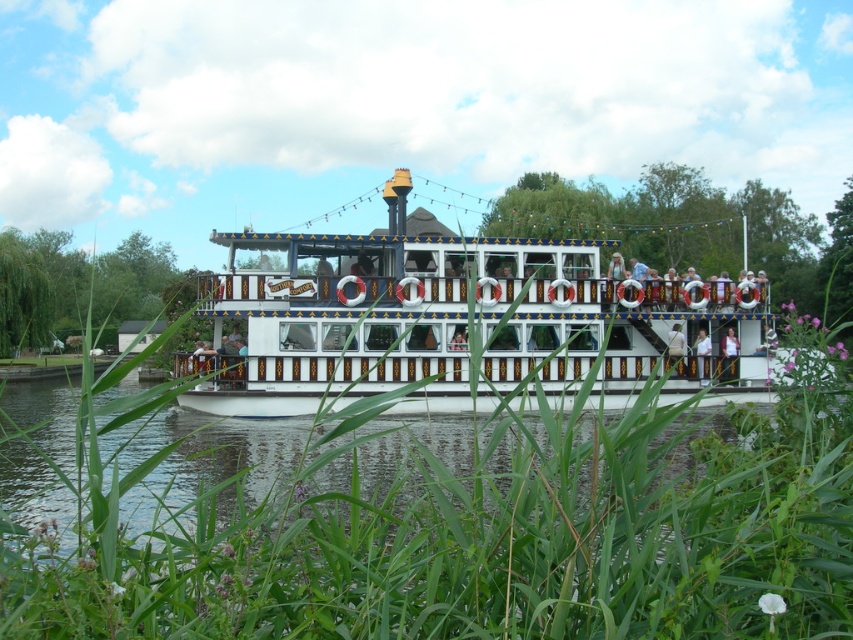
Describe the element at coordinates (451, 461) in the screenshot. I see `white painted wooden boat at center` at that location.

Is the position of white painted wooden boat at center less distant than that of white painted wood boat at center?

Yes.

Between point (570, 442) and point (637, 305), which one is positioned in front?

Point (570, 442) is in front.

The height and width of the screenshot is (640, 853). I want to click on white painted wooden boat at center, so click(451, 461).

Does white painted wooden boat at center appear on the left side of white smooth water at center?

No, white painted wooden boat at center is not to the left of white smooth water at center.

Between white painted wooden boat at center and white smooth water at center, which one appears on the left side from the viewer's perspective?

From the viewer's perspective, white smooth water at center appears more on the left side.

Which is in front, point (222, 572) or point (393, 417)?

Point (222, 572)

You are a GUI agent. You are given a task and a screenshot of the screen. Output one action in this format:
    pyautogui.click(x=<x>, y=<y>)
    Task: Click on the white painted wooden boat at center
    
    Given the screenshot: What is the action you would take?
    pyautogui.click(x=451, y=461)

Can you confirm if white painted wood boat at center is thinner than white smooth water at center?

Yes.

At what (x,y) coordinates should I click in order to perform the action: click on white painted wood boat at center. Please return your answer as a coordinate pair (x, y). Looking at the image, I should click on (463, 321).

This screenshot has width=853, height=640. What do you see at coordinates (463, 321) in the screenshot? I see `white painted wood boat at center` at bounding box center [463, 321].

Find the location of a particular element. white painted wood boat at center is located at coordinates (463, 321).